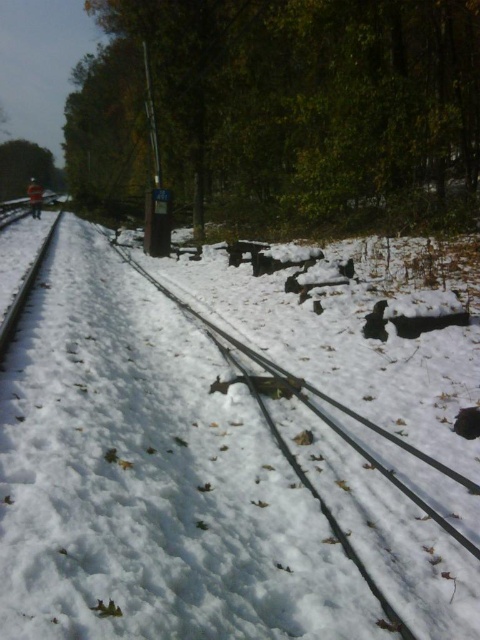
Question: Which is nearer to the smooth metal train track at left?

Choices:
 (A) green leafy tree at upper center
 (B) green matte tree at upper left

Answer: (A)

Question: Can you confirm if white matte snow at center is bigger than green leafy tree at upper center?

Choices:
 (A) yes
 (B) no

Answer: (B)

Question: Does white matte snow at center have a lesser width compared to smooth metal train track at left?

Choices:
 (A) no
 (B) yes

Answer: (A)

Question: Considering the real-world distances, which object is farthest from the green leafy tree at upper center?

Choices:
 (A) white matte snow at center
 (B) green matte tree at upper left

Answer: (B)

Question: Estimate the real-world distances between objects in this image. Which object is farther from the white matte snow at center?

Choices:
 (A) green matte tree at upper left
 (B) green leafy tree at upper center
 (C) smooth metal train track at left

Answer: (A)

Question: Can you confirm if green matte tree at upper left is thinner than smooth metal train track at left?

Choices:
 (A) yes
 (B) no

Answer: (B)